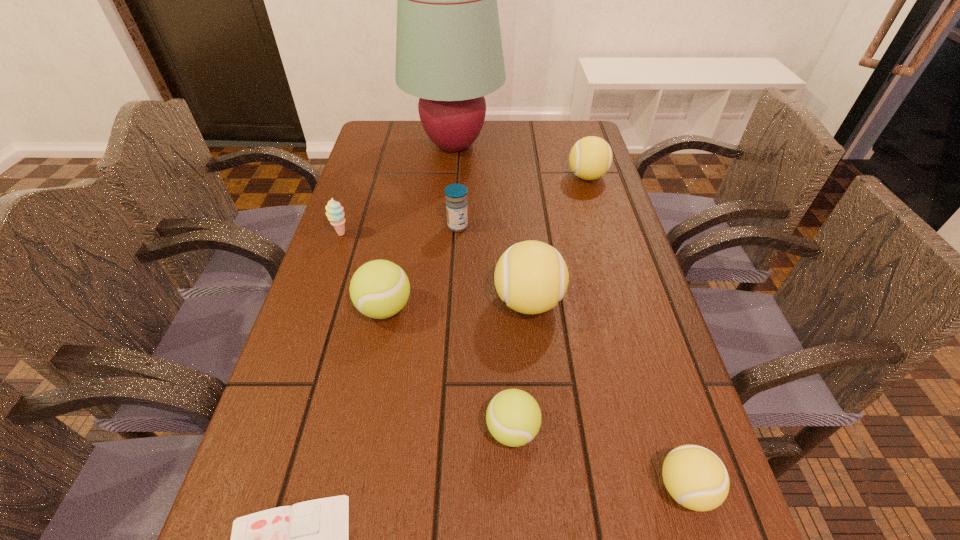
The height and width of the screenshot is (540, 960). Identify the location of vacant space at the far right corner of the desktop. (570, 128).

The width and height of the screenshot is (960, 540). I want to click on free spot between the nearer green tennis ball and the nearest tennis ball, so click(x=599, y=459).

In order to click on free space that is in between the nearest tennis ball and the blue lampshade in this screenshot , I will do 569,317.

You are a GUI agent. You are given a task and a screenshot of the screen. Output one action in this format:
    pyautogui.click(x=<x>, y=<y>)
    Task: Click on the free point between the nearest tennis ball and the nearer green tennis ball
    The width and height of the screenshot is (960, 540).
    Given the screenshot: What is the action you would take?
    pyautogui.click(x=599, y=459)

Locate an element on the screen. Image resolution: width=960 pixels, height=540 pixels. vacant space that is in between the second nearest tennis ball and the second farthest yellow tennis ball is located at coordinates (520, 366).

Find the location of a particular element. vacant region between the nearest tennis ball and the blue medicine is located at coordinates (571, 357).

Where is `object that is the closest one to the lampshade`? This screenshot has height=540, width=960. object that is the closest one to the lampshade is located at coordinates (590, 158).

Image resolution: width=960 pixels, height=540 pixels. Identify the location of the fifth closest object relative to the smallest yellow tennis ball. click(456, 203).

Locate which tennis ball ranks third in proximity to the left green tennis ball. Please provide its 2D coordinates. Your answer should be formatted as a tuple, i.e. [(x, y)], where the tuple contains the x and y coordinates of a point satisfying the conditions above.

[(695, 477)]

Find the location of `tennis ball that is the third nearest to the eighth shortest object`. tennis ball that is the third nearest to the eighth shortest object is located at coordinates (695, 477).